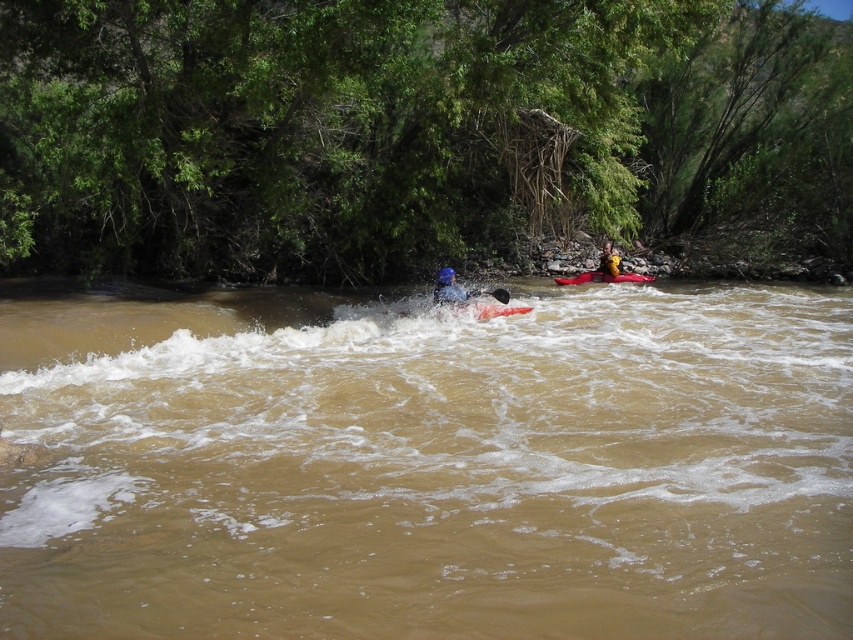
Is yellow fabric kayak at center below yellow fabric life jacket at center?

Indeed, yellow fabric kayak at center is positioned under yellow fabric life jacket at center.

Does yellow fabric kayak at center have a lesser width compared to yellow fabric life jacket at center?

Yes, yellow fabric kayak at center is thinner than yellow fabric life jacket at center.

Who is more forward, (612, 260) or (618, 268)?

Point (612, 260)

I want to click on yellow fabric kayak at center, so click(x=608, y=259).

How far apart are smooth orange kayak at center and yellow fabric kayak at center?

The distance of smooth orange kayak at center from yellow fabric kayak at center is 35.90 feet.

Measure the distance between point (518, 310) and camera.

The distance of point (518, 310) from camera is 15.83 meters.

Find the location of `smooth orange kayak at center`. smooth orange kayak at center is located at coordinates (497, 308).

Between point (428, 355) and point (560, 282), which one is positioned behind?

The point (560, 282) is behind.

Find the location of a particular element. brown muddy water at center is located at coordinates (427, 465).